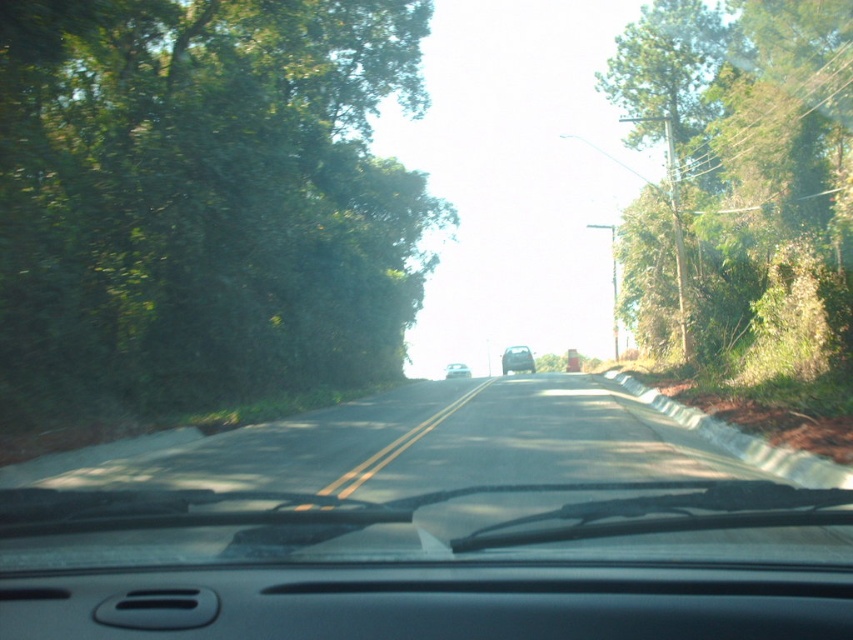
Question: Which object is closer to the camera taking this photo?

Choices:
 (A) silver metallic car at center
 (B) green leafy trees at left

Answer: (B)

Question: Can you confirm if asphalt road at center is bigger than silver metallic car at center?

Choices:
 (A) yes
 (B) no

Answer: (A)

Question: Considering the real-world distances, which object is closest to the silver metallic car at center?

Choices:
 (A) matte black car at center
 (B) green leafy trees at left
 (C) asphalt road at center
 (D) green leafy tree at right

Answer: (A)

Question: Considering the relative positions of asphalt road at center and matte black car at center in the image provided, where is asphalt road at center located with respect to matte black car at center?

Choices:
 (A) above
 (B) below

Answer: (B)

Question: Where is matte black car at center located in relation to silver metallic car at center in the image?

Choices:
 (A) above
 (B) below

Answer: (A)

Question: Considering the real-world distances, which object is farthest from the green leafy tree at right?

Choices:
 (A) matte black car at center
 (B) asphalt road at center
 (C) green leafy trees at left
 (D) silver metallic car at center

Answer: (D)